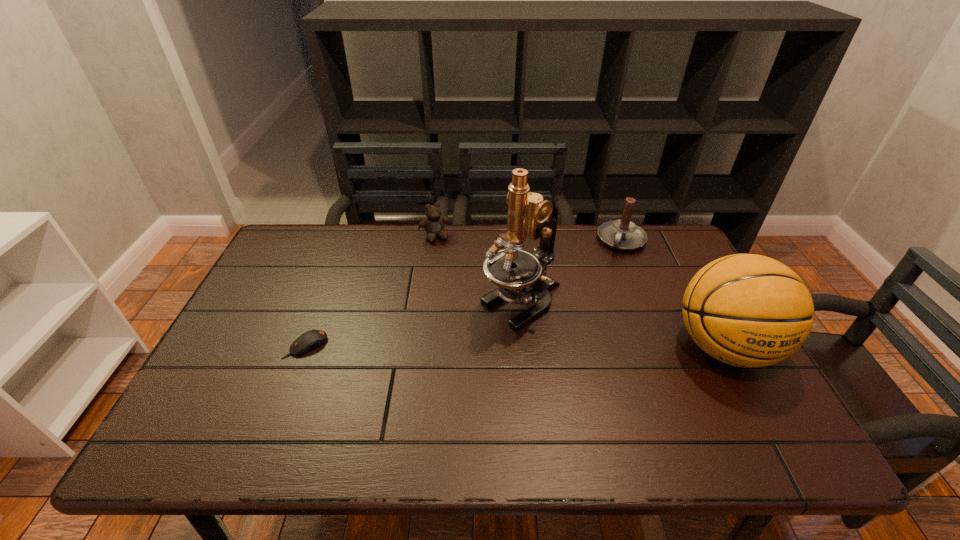
This screenshot has height=540, width=960. I want to click on object located at the near edge, so click(x=746, y=310).

At what (x,y) coordinates should I click in order to perform the action: click on basketball that is at the right edge. Please return your answer as a coordinate pair (x, y). Looking at the image, I should click on (746, 310).

Locate an element on the screen. candle located at the right edge is located at coordinates (622, 234).

In order to click on object that is at the far right corner in this screenshot , I will do `click(622, 234)`.

I want to click on object at the near right corner, so click(746, 310).

You are a GUI agent. You are given a task and a screenshot of the screen. Output one action in this format:
    pyautogui.click(x=<x>, y=<y>)
    Task: Click on the vacant space at the far edge
    
    Given the screenshot: What is the action you would take?
    pyautogui.click(x=418, y=228)

In the image, there is a desktop. Where is `vacant space at the left edge`? Image resolution: width=960 pixels, height=540 pixels. vacant space at the left edge is located at coordinates (284, 302).

Where is `vacant area at the right edge of the desktop`? This screenshot has height=540, width=960. vacant area at the right edge of the desktop is located at coordinates pos(721,379).

You are a GUI agent. You are given a task and a screenshot of the screen. Output one action in this format:
    pyautogui.click(x=<x>, y=<y>)
    Task: Click on the free spot at the far left corner of the desktop
    This screenshot has width=960, height=540.
    Given the screenshot: What is the action you would take?
    pyautogui.click(x=311, y=248)

You are a GUI agent. You are given a task and a screenshot of the screen. Output one action in this format:
    pyautogui.click(x=<x>, y=<y>)
    Task: Click on the vacant area at the near left corner
    
    Given the screenshot: What is the action you would take?
    221,391